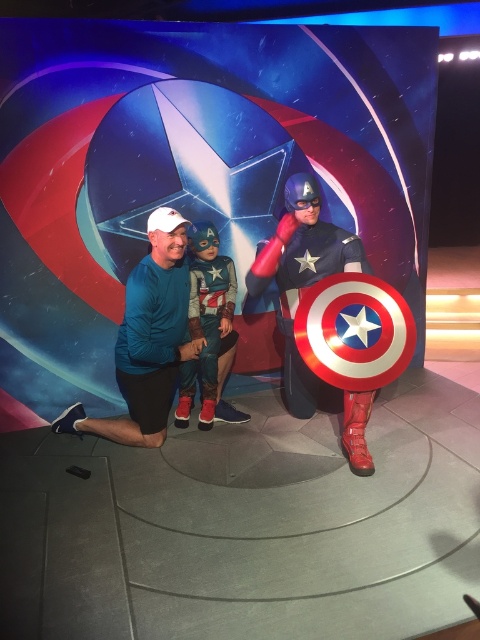
Question: Which point is farther from the camera taking this photo?

Choices:
 (A) (210, 330)
 (B) (120, 432)
 (C) (343, 422)

Answer: (C)

Question: In this image, where is blue fabric shirt at center located relative to shiny metallic captain america shield at center?

Choices:
 (A) below
 (B) above

Answer: (A)

Question: Can you confirm if blue fabric shirt at center is positioned to the right of shiny metallic costume at center?

Choices:
 (A) yes
 (B) no

Answer: (B)

Question: Among these objects, which one is farthest from the camera?

Choices:
 (A) blue fabric shirt at center
 (B) shiny metallic captain america shield at center

Answer: (B)

Question: Is shiny metallic captain america shield at center closer to camera compared to shiny metallic costume at center?

Choices:
 (A) yes
 (B) no

Answer: (A)

Question: Which of these objects is positioned closest to the blue fabric shirt at center?

Choices:
 (A) shiny metallic costume at center
 (B) shiny metallic captain america shield at center

Answer: (A)